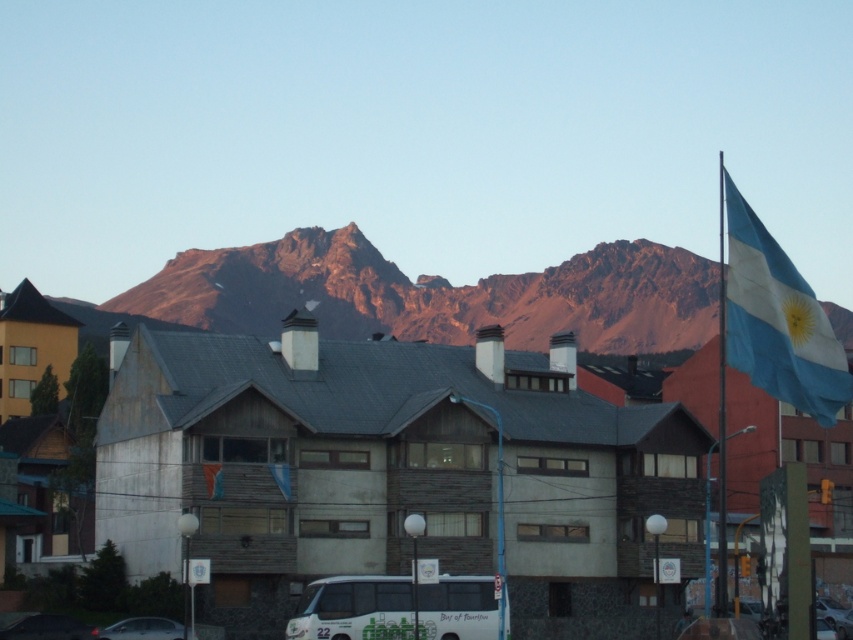
How distant is shiny black car at lower left from matte black car at lower left?

They are 3.61 meters apart.

Is shiny black car at lower left in front of matte black car at lower left?

Yes.

This screenshot has width=853, height=640. Identify the location of shiny black car at lower left. (48, 627).

Locate an element on the screen. The height and width of the screenshot is (640, 853). shiny black car at lower left is located at coordinates (48, 627).

Does white matte bus at lower center have a lesser height compared to shiny black car at lower left?

In fact, white matte bus at lower center may be taller than shiny black car at lower left.

Is white matte bus at lower center to the right of shiny black car at lower left from the viewer's perspective?

Indeed, white matte bus at lower center is positioned on the right side of shiny black car at lower left.

Is point (407, 612) behind point (68, 630)?

No, it is in front of (68, 630).

In order to click on white matte bus at lower center in this screenshot , I will do `click(354, 609)`.

Is wooden cabin at center to the right of white matte bus at lower center from the viewer's perspective?

No, wooden cabin at center is not to the right of white matte bus at lower center.

Who is more forward, (x=601, y=576) or (x=363, y=608)?

Point (x=363, y=608) is more forward.

Is point (691, 516) positioned in front of point (473, 602)?

No.

Locate an element on the screen. This screenshot has height=640, width=853. wooden cabin at center is located at coordinates (387, 468).